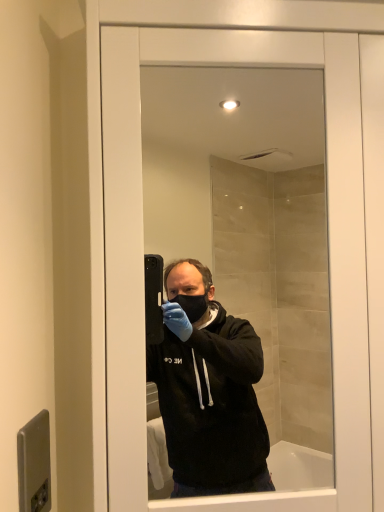
Question: Based on their sizes in the image, would you say metallic gray door handle at lower left is bigger or smaller than transparent glass mirror at center?

Choices:
 (A) small
 (B) big

Answer: (A)

Question: Considering the positions of point (21, 450) and point (274, 89), is point (21, 450) closer or farther from the camera than point (274, 89)?

Choices:
 (A) closer
 (B) farther

Answer: (A)

Question: From a real-world perspective, is metallic gray door handle at lower left above or below transparent glass mirror at center?

Choices:
 (A) below
 (B) above

Answer: (A)

Question: Is transparent glass mirror at center taller or shorter than metallic gray door handle at lower left?

Choices:
 (A) short
 (B) tall

Answer: (B)

Question: Would you say transparent glass mirror at center is inside or outside metallic gray door handle at lower left?

Choices:
 (A) outside
 (B) inside

Answer: (A)

Question: Relative to metallic gray door handle at lower left, is transparent glass mirror at center in front or behind?

Choices:
 (A) front
 (B) behind

Answer: (B)

Question: Considering the positions of transparent glass mirror at center and metallic gray door handle at lower left in the image, is transparent glass mirror at center bigger or smaller than metallic gray door handle at lower left?

Choices:
 (A) small
 (B) big

Answer: (B)